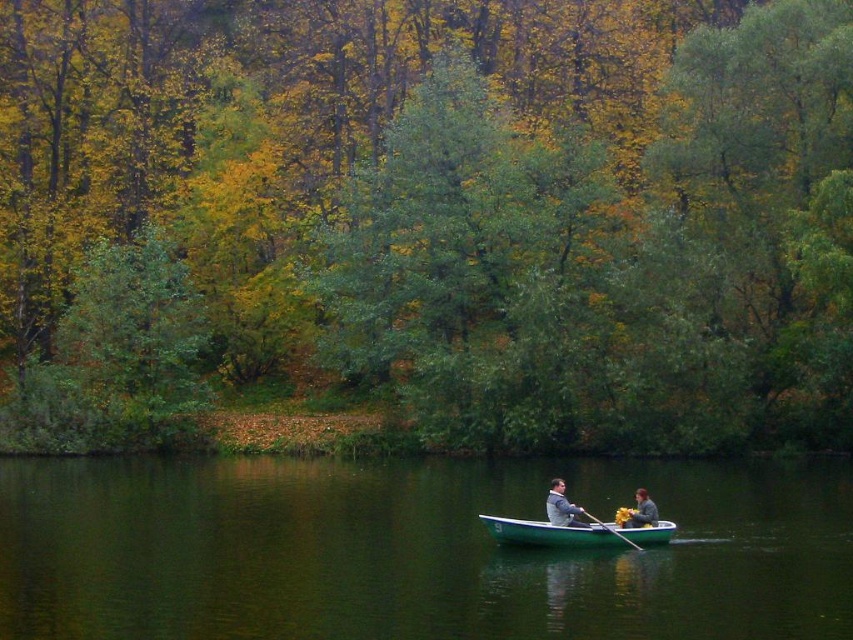
You are a photographer trying to capture a clear shot of both the gray fabric jacket at lower center and the gray fabric jacket at center. Since you want both jackets to appear equally tall in the photo, which jacket should you move closer to the camera?

The gray fabric jacket at lower center is much taller than the gray fabric jacket at center. To make them appear equally tall in the photo, you should move the shorter gray fabric jacket at center closer to the camera.

You are standing on the dock and see the gray fabric jacket at lower center and the wooden smooth paddle at lower center in the boat. Which object is closer to the water surface?

The wooden smooth paddle at lower center is closer to the water surface because it is shorter than the gray fabric jacket at lower center, which is taller.

You are standing on the dock and see the point marked at coordinates (412, 552). What is the location of this point relative to the green smooth water at center?

The point at coordinates (412, 552) is located on the green smooth water at center.